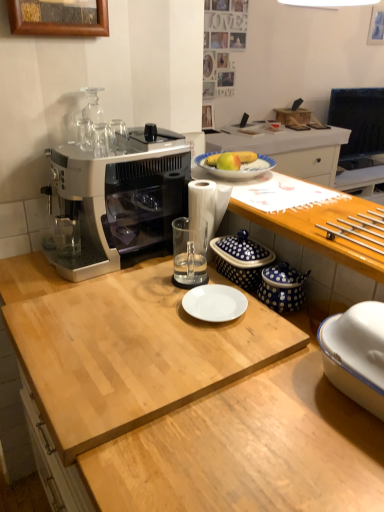
Question: From a real-world perspective, is clear glass cups at upper left, the 1th tableware positioned from the top, below light wood cutting board at center, which is counted as the first desk, starting from the bottom?

Choices:
 (A) no
 (B) yes

Answer: (A)

Question: From a real-world perspective, is clear glass cups at upper left, the 1th tableware positioned from the top, physically above light wood cutting board at center, which ranks as the second desk in top-to-bottom order?

Choices:
 (A) no
 (B) yes

Answer: (B)

Question: Can you confirm if clear glass cups at upper left, acting as the third tableware starting from the right, is smaller than light wood cutting board at center, which ranks as the second desk in top-to-bottom order?

Choices:
 (A) no
 (B) yes

Answer: (B)

Question: Is clear glass cups at upper left, the 1th tableware positioned from the top, facing away from light wood cutting board at center, which ranks as the second desk in top-to-bottom order?

Choices:
 (A) no
 (B) yes

Answer: (A)

Question: From the image's perspective, is clear glass cups at upper left, the 3th tableware when ordered from bottom to top, beneath light wood cutting board at center, which ranks as the second desk in top-to-bottom order?

Choices:
 (A) no
 (B) yes

Answer: (A)

Question: Is the depth of clear glass cups at upper left, the 1th tableware positioned from the top, less than that of light wood cutting board at center, which ranks as the second desk in top-to-bottom order?

Choices:
 (A) no
 (B) yes

Answer: (A)

Question: Would you consider blue polka dot ceramic container at center, arranged as the 2th appliance when viewed from the front, to be distant from metallic silver drawer handles at right, the 1th tableware in the right-to-left sequence?

Choices:
 (A) no
 (B) yes

Answer: (A)

Question: Is blue polka dot ceramic container at center, positioned as the first appliance in back-to-front order, directly adjacent to metallic silver drawer handles at right, the 2th tableware when ordered from top to bottom?

Choices:
 (A) no
 (B) yes

Answer: (A)

Question: Is metallic silver drawer handles at right, the 1th tableware in the right-to-left sequence, at the back of blue polka dot ceramic container at center, arranged as the 2th appliance when viewed from the front?

Choices:
 (A) no
 (B) yes

Answer: (A)

Question: Considering the relative sizes of blue polka dot ceramic container at center, positioned as the first appliance in back-to-front order, and metallic silver drawer handles at right, the 2th tableware when ordered from top to bottom, in the image provided, is blue polka dot ceramic container at center, positioned as the first appliance in back-to-front order, taller than metallic silver drawer handles at right, the 2th tableware when ordered from top to bottom,?

Choices:
 (A) no
 (B) yes

Answer: (B)

Question: Can you confirm if blue polka dot ceramic container at center, arranged as the 2th appliance when viewed from the front, is positioned to the right of metallic silver drawer handles at right, the 2th tableware when ordered from top to bottom?

Choices:
 (A) no
 (B) yes

Answer: (A)

Question: Does blue polka dot ceramic container at center, positioned as the first appliance in back-to-front order, have a lesser height compared to metallic silver drawer handles at right, the 1th tableware in the right-to-left sequence?

Choices:
 (A) yes
 (B) no

Answer: (B)

Question: Is blue dotted ceramic jars at right, positioned as the 2th appliance in back-to-front order, positioned before yellow matte apple at center?

Choices:
 (A) yes
 (B) no

Answer: (A)